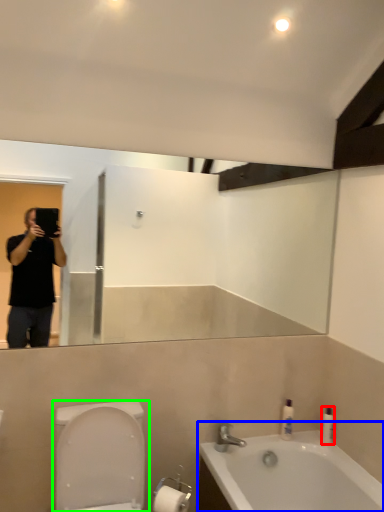
Question: Based on their relative distances, which object is nearer to toiletry (highlighted by a red box)? Choose from bathtub (highlighted by a blue box) and toilet (highlighted by a green box).

Choices:
 (A) bathtub
 (B) toilet

Answer: (A)